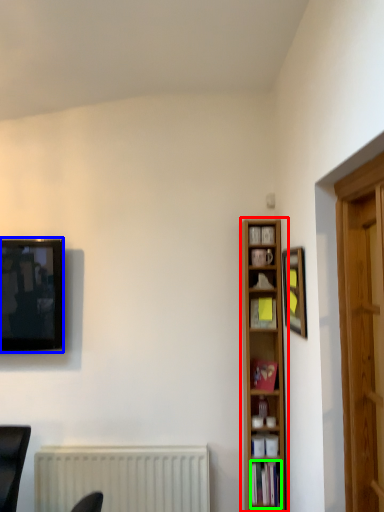
Question: Estimate the real-world distances between objects in this image. Which object is farther from bookcase (highlighted by a red box), television (highlighted by a blue box) or book (highlighted by a green box)?

Choices:
 (A) television
 (B) book

Answer: (A)